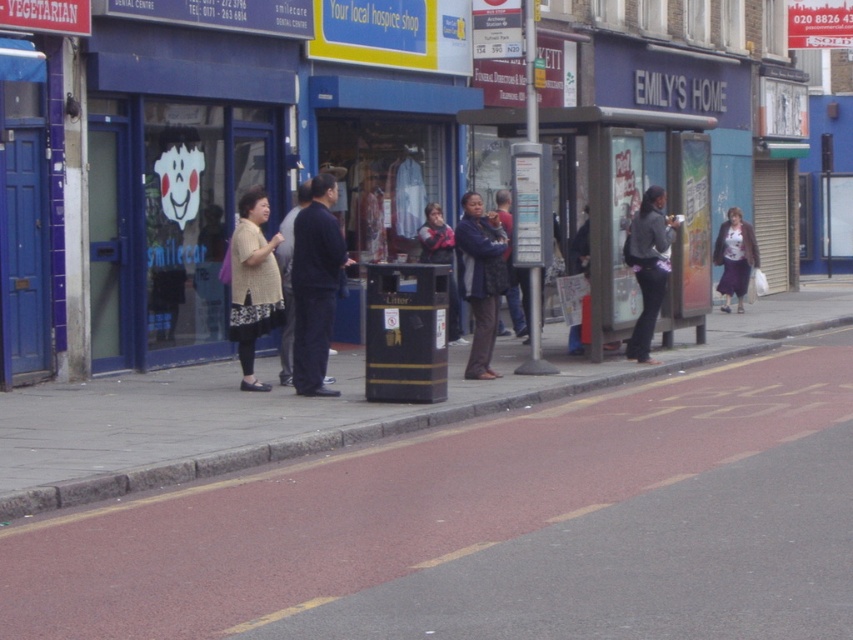
Question: Estimate the real-world distances between objects in this image. Which object is closer to the matte black jacket at center?

Choices:
 (A) dark gray fabric jacket at right
 (B) matte purple skirt at right

Answer: (A)

Question: Based on their relative distances, which object is nearer to the matte purple skirt at right?

Choices:
 (A) dark blue fabric jacket at center
 (B) matte black jacket at center

Answer: (B)

Question: Estimate the real-world distances between objects in this image. Which object is farther from the matte purple skirt at right?

Choices:
 (A) concrete sidewalk at lower left
 (B) dark blue fabric jacket at center
 (C) knitted beige sweater at center

Answer: (C)

Question: Is dark blue textured coat at center further to camera compared to dark gray fabric jacket at right?

Choices:
 (A) no
 (B) yes

Answer: (A)

Question: Where is matte black jacket at center located in relation to dark blue jacket at center in the image?

Choices:
 (A) below
 (B) above

Answer: (B)

Question: Can you confirm if matte purple skirt at right is positioned to the left of dark blue jacket at center?

Choices:
 (A) yes
 (B) no

Answer: (B)